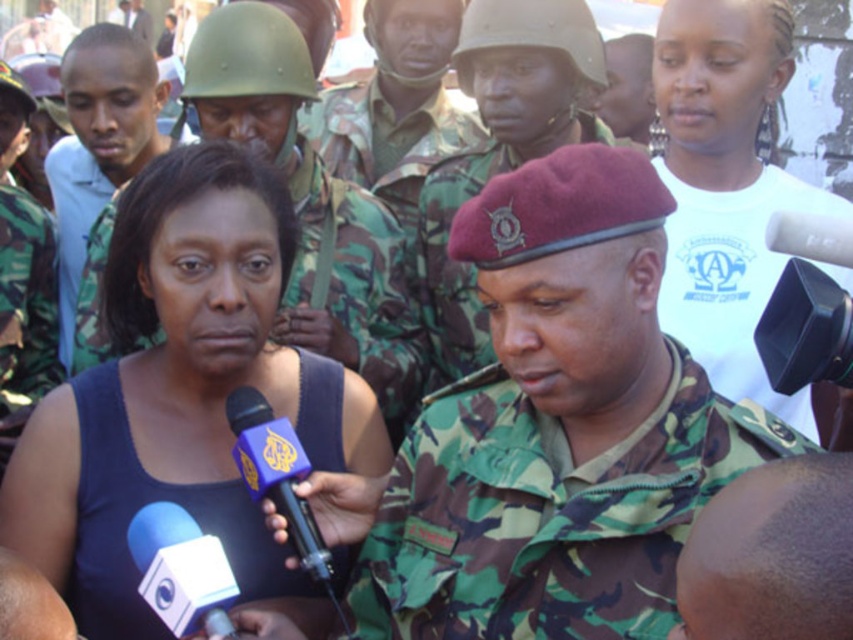
You are a photographer at the back of the room during a press conference. You need to take a clear photo of both the camo fabric uniform at center and the dark skin bald head at center. Which one might block the view of the other?

The camo fabric uniform at center is taller than dark skin bald head at center, so it might block the view of the dark skin bald head at center.

You are a photographer positioned at the back of the room. You need to take a clear photo of the camo fabric uniform at center and the white cotton shirt at upper right. Which subject will appear larger in your photo?

The camo fabric uniform at center will appear larger in the photo because it is closer to the viewer than the white cotton shirt at upper right.

You are a photographer at the back of the room. You need to take a clear photo of both the camo fabric uniform at center and the dark skin bald head at center. Which object should you zoom in on first to ensure both are in focus?

You should zoom in on the dark skin bald head at center first because it is larger than the camo fabric uniform at center, ensuring both will be in focus when adjusted properly.